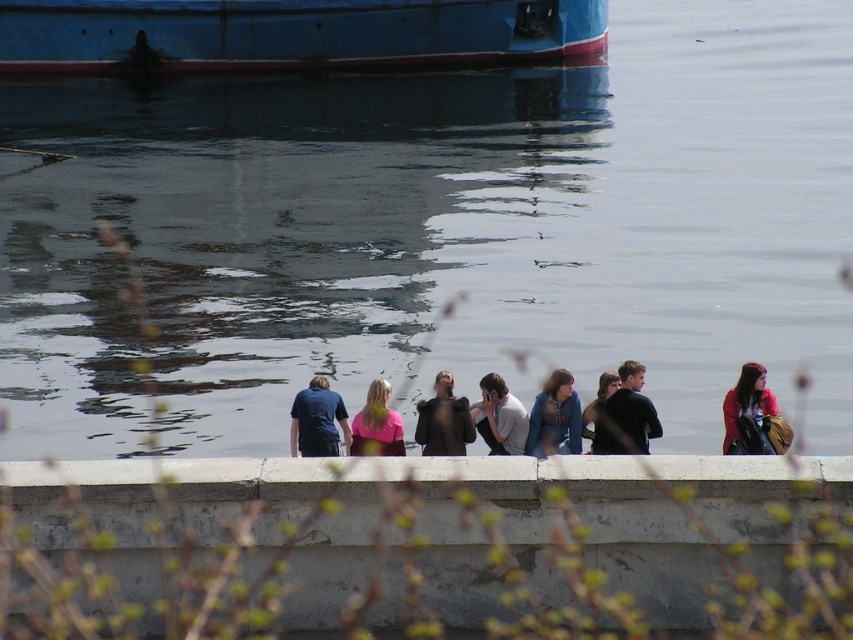
You are a photographer trying to capture a photo of the concrete ledge at lower center and the matte pink shirt at lower right. Considering their heights, which object should you focus on first to ensure proper framing?

The concrete ledge at lower center is taller than the matte pink shirt at lower right, so you should focus on the concrete ledge at lower center first to ensure proper framing.

You are standing at the origin point of this scene. A blue painted wood boat at upper left is located at point (289,35). If you want to reach the boat, which direction should you move in relation to your current position?

The blue painted wood boat at upper left is located at point (289,35), so you should move northeast to reach it.

You are a photographer trying to capture both the dark blue shirt at center and the matte pink shirt at lower right in a single shot. Based on their positions, which shirt is closer to the camera?

The dark blue shirt at center is positioned over the matte pink shirt at lower right, meaning it is closer to the camera.